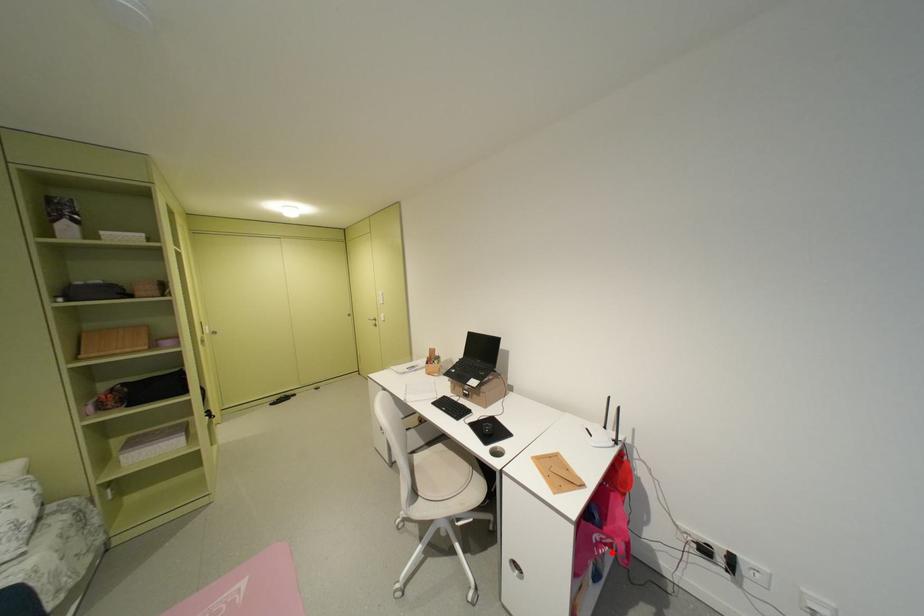
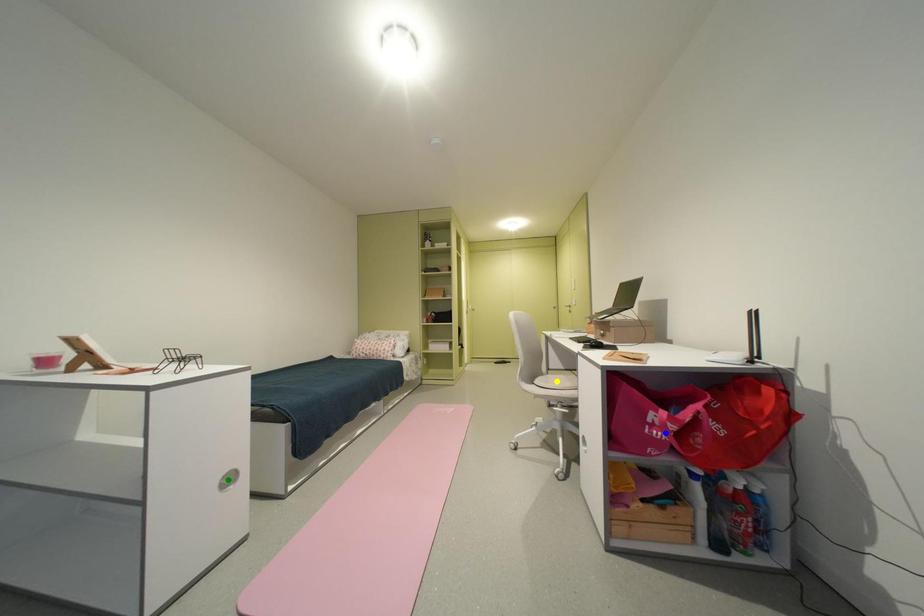
Question: I am providing you with two images of the same scene from different viewpoints. A red point is marked on the first image. You are given multiple points on the second image. Which mark in image 2 goes with the point in image 1?

Choices:
 (A) blue point
 (B) yellow point
 (C) green point

Answer: (A)